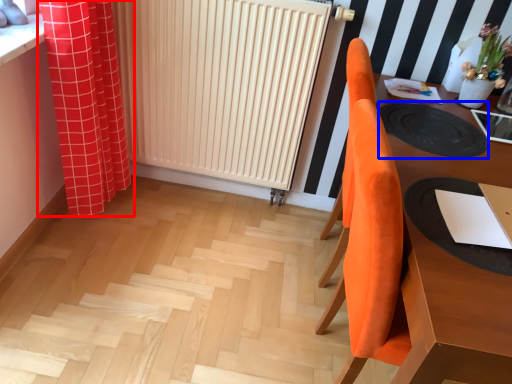
Question: Which of the following is the closest to the observer, curtain (highlighted by a red box) or mat (highlighted by a blue box)?

Choices:
 (A) curtain
 (B) mat

Answer: (B)